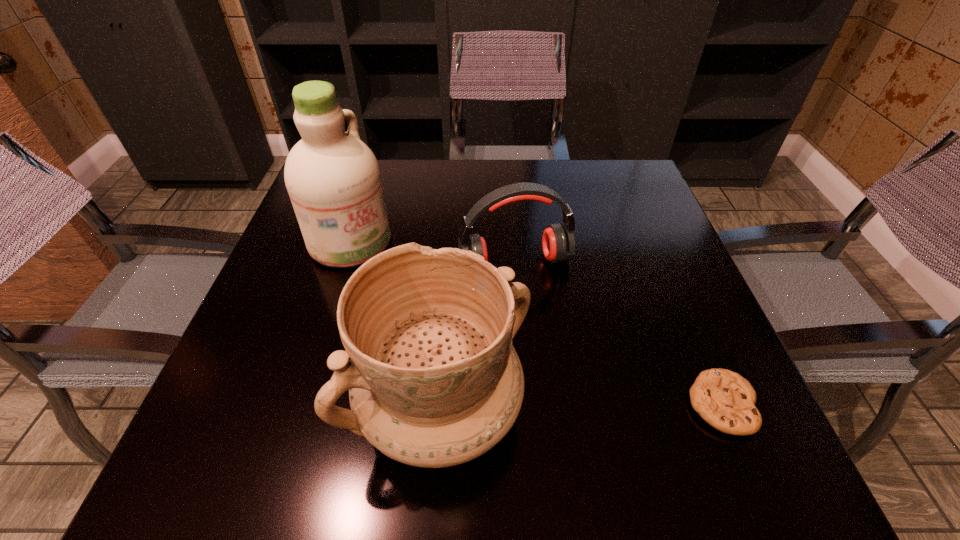
Select which object is the third closest to the tallest object. Please provide its 2D coordinates. Your answer should be formatted as a tuple, i.e. [(x, y)], where the tuple contains the x and y coordinates of a point satisfying the conditions above.

[(724, 399)]

Where is `vacant position in the image that satisfies the following two spatial constraints: 1. on the front side of the rightmost object; 2. on the right side of the tallest object`? The height and width of the screenshot is (540, 960). vacant position in the image that satisfies the following two spatial constraints: 1. on the front side of the rightmost object; 2. on the right side of the tallest object is located at coordinates (299, 404).

Find the location of a particular element. The width and height of the screenshot is (960, 540). vacant region that satisfies the following two spatial constraints: 1. on the back side of the pottery; 2. on the left side of the cookie is located at coordinates (442, 404).